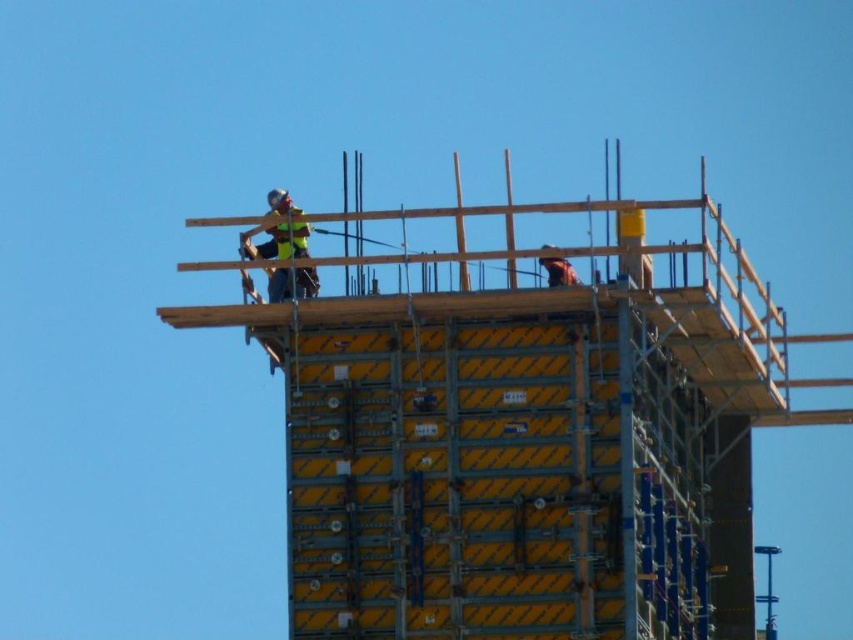
Question: Based on their relative distances, which object is nearer to the yellow metallic scaffolding at upper center?

Choices:
 (A) yellow reflective safety vest at upper center
 (B) yellow reflective vest at upper center

Answer: (B)

Question: Can you confirm if yellow reflective safety vest at upper center is positioned to the right of brown leather helmet at upper right?

Choices:
 (A) no
 (B) yes

Answer: (A)

Question: Which point appears closest to the camera in this image?

Choices:
 (A) (547, 269)
 (B) (297, 630)
 (C) (292, 209)
 (D) (260, 228)

Answer: (B)

Question: Where is yellow reflective safety vest at upper center located in relation to brown leather helmet at upper right in the image?

Choices:
 (A) below
 (B) above

Answer: (B)

Question: In this image, where is yellow reflective safety vest at upper center located relative to brown leather helmet at upper right?

Choices:
 (A) left
 (B) right

Answer: (A)

Question: Which of the following is the closest to the observer?

Choices:
 (A) (271, 236)
 (B) (308, 225)
 (C) (550, 269)

Answer: (C)